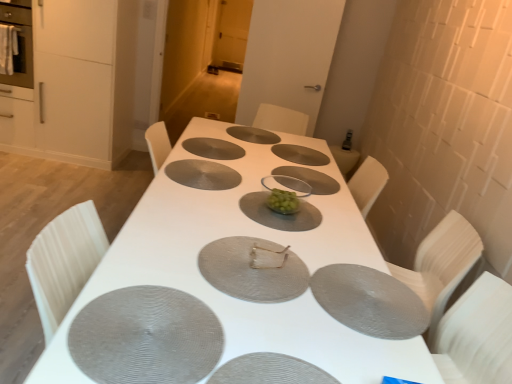
Find the location of `empty space that is in between gray textured placemat at center, the fourth pizza pan viewed from the back, and gray textured placemat at lower right, which is the third pizza pan from front to back`. empty space that is in between gray textured placemat at center, the fourth pizza pan viewed from the back, and gray textured placemat at lower right, which is the third pizza pan from front to back is located at coordinates (264, 215).